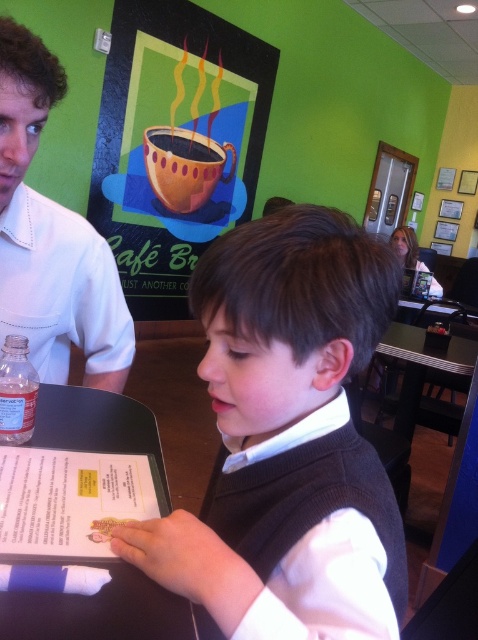
You are a customer sitting at the table in the image. You want to grab the matte coffee cup at upper center to take a sip. Is the cup within easy reach of your hand, considering the white shirt at left is part of your outfit?

The matte coffee cup at upper center is above the white shirt at left, so it is positioned higher than your hand. You may need to stretch your arm upwards to reach it comfortably.

What is located at the point coordinates (175, 144)?

The point coordinates (175, 144) indicate the location of the matte coffee cup at upper center.

Where is the matte coffee cup at upper center located in the image?

The matte coffee cup at upper center is located at point (175, 144) in the image.